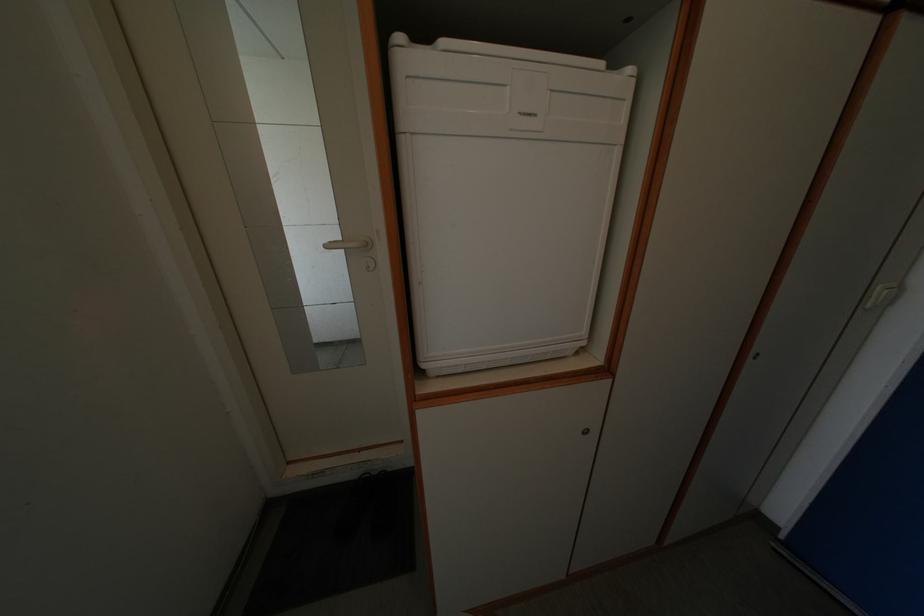
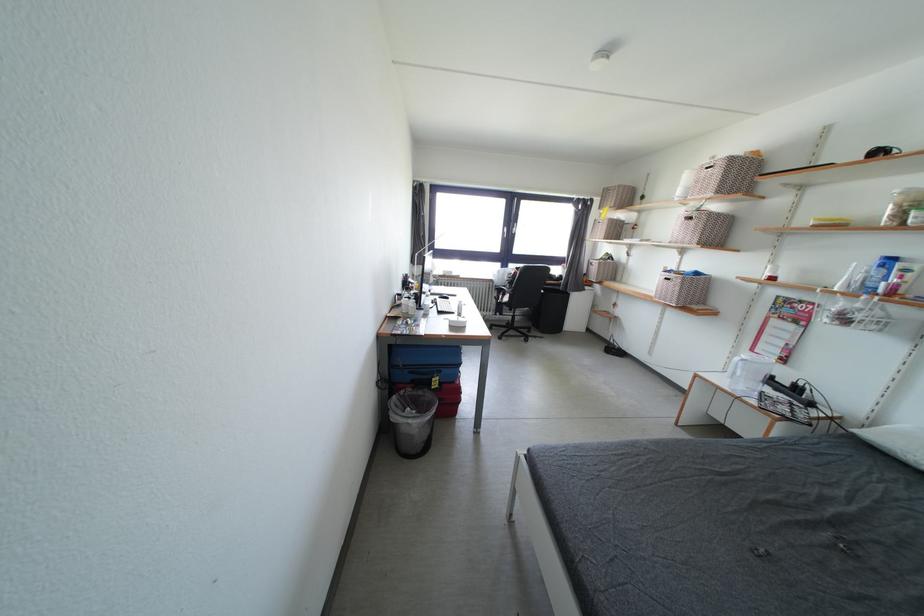
First-person continuous shooting, in which direction is the camera rotating?

The camera rotated toward left-down.